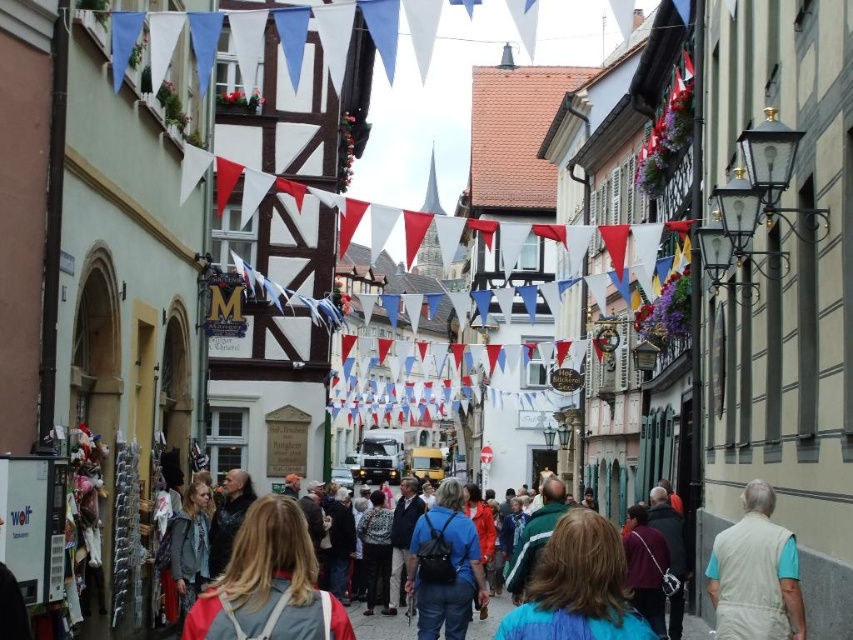
Question: Which of the following is the farthest from the observer?

Choices:
 (A) blue fabric backpack at center
 (B) purple fabric purse at center
 (C) gray fabric backpack at center
 (D) patterned fabric dress at center

Answer: (D)

Question: Does purple fabric purse at center appear on the right side of patterned fabric dress at center?

Choices:
 (A) no
 (B) yes

Answer: (B)

Question: Which of these objects is positioned farthest from the beige fabric vest at lower right?

Choices:
 (A) blue fabric jacket at center
 (B) gray fabric backpack at center

Answer: (B)

Question: Is blue fabric backpack at center to the left of denim jacket at lower left from the viewer's perspective?

Choices:
 (A) yes
 (B) no

Answer: (B)

Question: Which point appears closest to the camera in this image?

Choices:
 (A) (589, 550)
 (B) (651, 538)

Answer: (A)

Question: Where is blue fabric jacket at center located in relation to beige fabric vest at lower right in the image?

Choices:
 (A) above
 (B) below

Answer: (B)